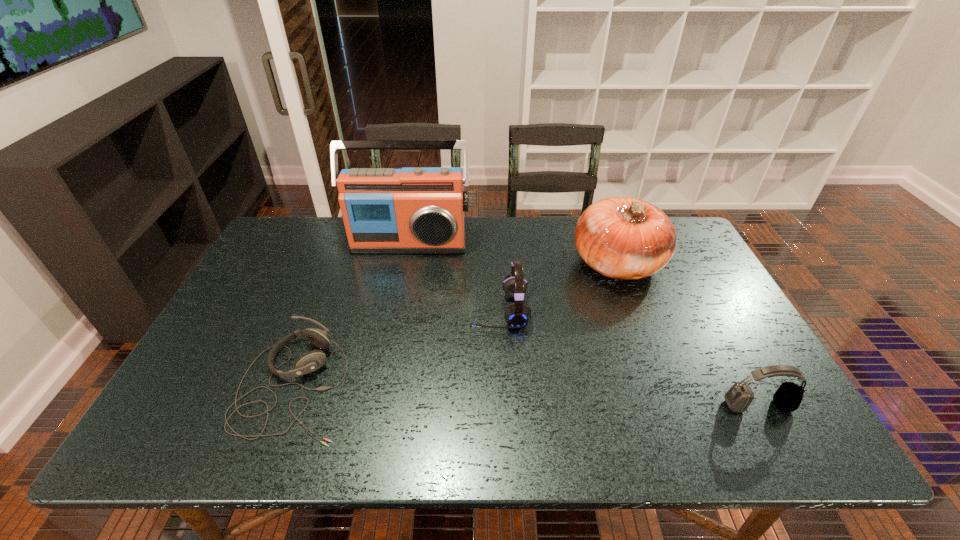
Find the location of a particular element. The image size is (960, 540). vacant position located 0.160m on the ear cushions of the third object from right to left is located at coordinates (413, 310).

Locate an element on the screen. Image resolution: width=960 pixels, height=540 pixels. blank area located on the ear cushions of the third object from right to left is located at coordinates (427, 310).

Locate an element on the screen. This screenshot has height=540, width=960. vacant space located 0.180m on the ear cushions of the third object from right to left is located at coordinates (406, 310).

This screenshot has width=960, height=540. What are the coordinates of `vacant space located 0.390m on the outer surface of the leftmost headset` in the screenshot? It's located at 515,384.

Find the location of `radio receiver present at the far edge`. radio receiver present at the far edge is located at coordinates (420, 210).

Identify the location of pumpkin at the far edge. (624, 238).

You are a GUI agent. You are given a task and a screenshot of the screen. Output one action in this format:
    pyautogui.click(x=<x>, y=<y>)
    Task: Click on the object present at the near edge
    The height and width of the screenshot is (540, 960).
    Given the screenshot: What is the action you would take?
    pyautogui.click(x=311, y=361)

What are the coordinates of `object positioned at the left edge` in the screenshot? It's located at (311, 361).

The height and width of the screenshot is (540, 960). I want to click on pumpkin at the right edge, so click(x=624, y=238).

Locate an element on the screen. This screenshot has height=540, width=960. headset located in the right edge section of the desktop is located at coordinates (788, 397).